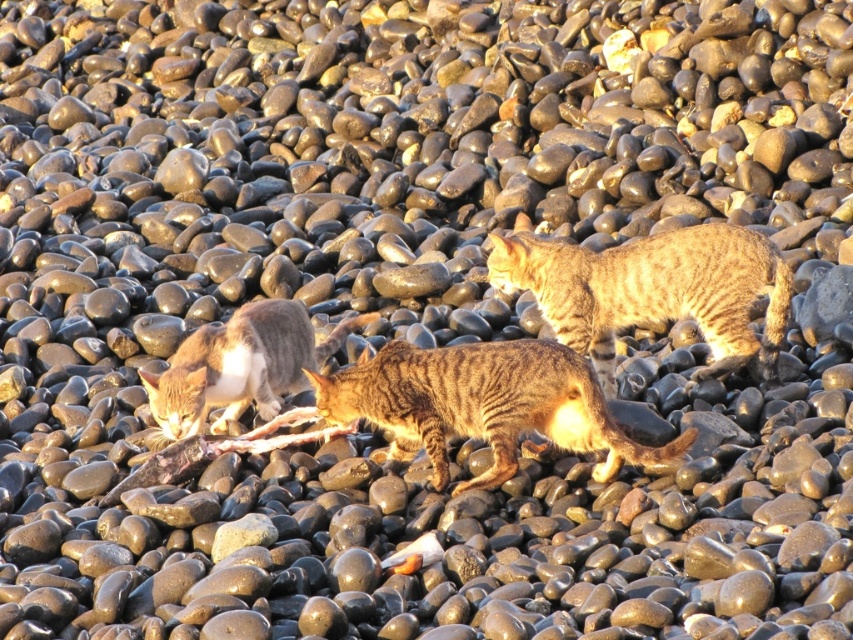
Question: Where is striped fur cat at center located in relation to tabby fur cat at lower left in the image?

Choices:
 (A) above
 (B) below

Answer: (B)

Question: Is striped fur cat at center smaller than tabby fur cat at lower left?

Choices:
 (A) yes
 (B) no

Answer: (B)

Question: Considering the real-world distances, which object is closest to the tabby fur cat at lower left?

Choices:
 (A) striped fur cat at center
 (B) tabby fur cat at center

Answer: (A)

Question: Which object is closer to the camera taking this photo?

Choices:
 (A) tabby fur cat at lower left
 (B) tabby fur cat at center
 (C) striped fur cat at center

Answer: (C)

Question: Does striped fur cat at center come behind tabby fur cat at lower left?

Choices:
 (A) yes
 (B) no

Answer: (B)

Question: Which is farther from the tabby fur cat at lower left?

Choices:
 (A) striped fur cat at center
 (B) tabby fur cat at center

Answer: (B)